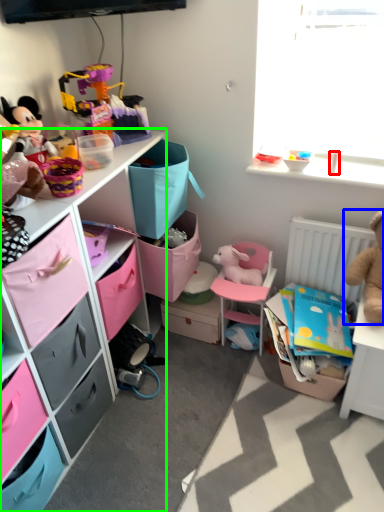
Question: Which object is the closest to the toy (highlighted by a red box)? Choose among these: toy (highlighted by a blue box) or cabinetry (highlighted by a green box).

Choices:
 (A) toy
 (B) cabinetry

Answer: (A)